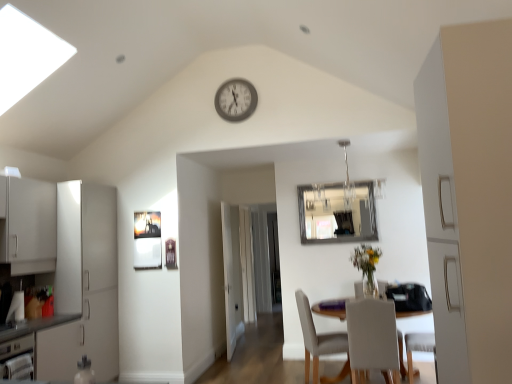
Question: Considering the relative sizes of white glossy cabinet at left and metallic silver dishwasher at lower left in the image provided, is white glossy cabinet at left bigger than metallic silver dishwasher at lower left?

Choices:
 (A) yes
 (B) no

Answer: (A)

Question: Can you confirm if white glossy cabinet at left is positioned to the right of metallic silver dishwasher at lower left?

Choices:
 (A) yes
 (B) no

Answer: (B)

Question: Is white glossy cabinet at left behind metallic silver dishwasher at lower left?

Choices:
 (A) yes
 (B) no

Answer: (A)

Question: Is white glossy cabinet at left closer to camera compared to metallic silver dishwasher at lower left?

Choices:
 (A) yes
 (B) no

Answer: (B)

Question: From a real-world perspective, is white glossy cabinet at left located beneath metallic silver dishwasher at lower left?

Choices:
 (A) no
 (B) yes

Answer: (A)

Question: In the image, is white fabric chair at lower center, acting as the first chair starting from the front, positioned in front of or behind transparent glass door at center?

Choices:
 (A) front
 (B) behind

Answer: (A)

Question: Based on their sizes in the image, would you say white fabric chair at lower center, acting as the first chair starting from the front, is bigger or smaller than transparent glass door at center?

Choices:
 (A) big
 (B) small

Answer: (A)

Question: From their relative heights in the image, would you say white fabric chair at lower center, acting as the first chair starting from the front, is taller or shorter than transparent glass door at center?

Choices:
 (A) short
 (B) tall

Answer: (A)

Question: Visually, is white fabric chair at lower center, acting as the second chair starting from the back, positioned to the left or to the right of transparent glass door at center?

Choices:
 (A) left
 (B) right

Answer: (B)

Question: In the image, is white fabric chair at lower center, acting as the first chair starting from the front, positioned in front of or behind white matte cabinet at right?

Choices:
 (A) behind
 (B) front

Answer: (A)

Question: Is white fabric chair at lower center, acting as the second chair starting from the back, spatially inside white matte cabinet at right, or outside of it?

Choices:
 (A) inside
 (B) outside

Answer: (B)

Question: In terms of width, does white fabric chair at lower center, acting as the first chair starting from the front, look wider or thinner when compared to white matte cabinet at right?

Choices:
 (A) wide
 (B) thin

Answer: (A)

Question: From a real-world perspective, is white fabric chair at lower center, acting as the second chair starting from the back, above or below white matte cabinet at right?

Choices:
 (A) below
 (B) above

Answer: (A)

Question: From the image's perspective, relative to white wooden door at center, is metallic silver dishwasher at lower left above or below?

Choices:
 (A) above
 (B) below

Answer: (B)

Question: Is metallic silver dishwasher at lower left to the left or to the right of white wooden door at center in the image?

Choices:
 (A) left
 (B) right

Answer: (A)